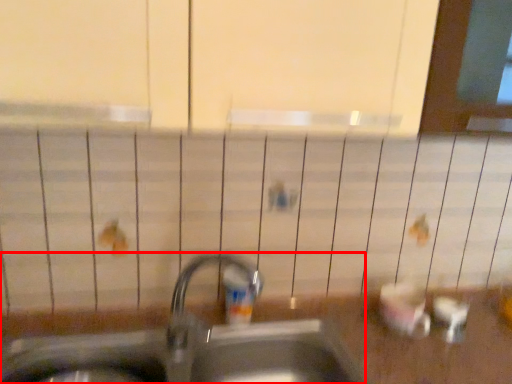
Question: Considering the relative positions of sink (annotated by the red box) and toiletry in the image provided, where is sink (annotated by the red box) located with respect to the staircase?

Choices:
 (A) right
 (B) left

Answer: (B)